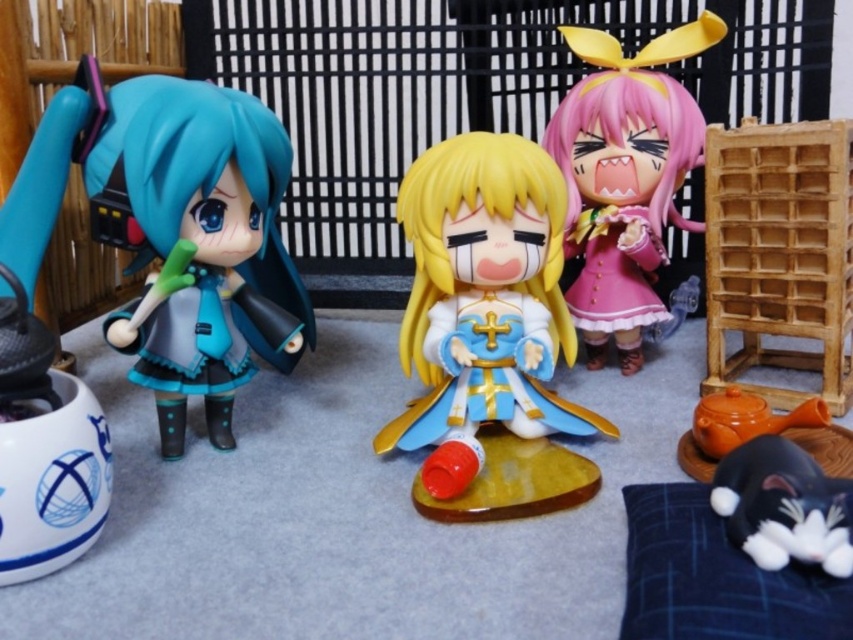
Is point (436, 189) positioned behind point (172, 300)?

That is True.

Is shiny plastic figure at center to the right of matte black doll at left from the viewer's perspective?

Correct, you'll find shiny plastic figure at center to the right of matte black doll at left.

Who is more distant from viewer, [412,442] or [263,298]?

The point [263,298] is behind.

In order to click on shiny plastic figure at center in this screenshot , I will do [x=489, y=326].

Which is above, pink matte plush at center or black glossy plush toy at lower right?

pink matte plush at center is above.

Which is below, pink matte plush at center or black glossy plush toy at lower right?

black glossy plush toy at lower right is below.

At what (x,y) coordinates should I click in order to perform the action: click on pink matte plush at center. Please return your answer as a coordinate pair (x, y). The height and width of the screenshot is (640, 853). Looking at the image, I should click on pyautogui.click(x=624, y=177).

Does matte black doll at left appear on the left side of black glossy plush toy at lower right?

Indeed, matte black doll at left is positioned on the left side of black glossy plush toy at lower right.

Which is below, matte black doll at left or black glossy plush toy at lower right?

black glossy plush toy at lower right is lower down.

Is point (173, 116) behind point (776, 518)?

Yes.

Where is `matte black doll at left`? This screenshot has width=853, height=640. matte black doll at left is located at coordinates (202, 246).